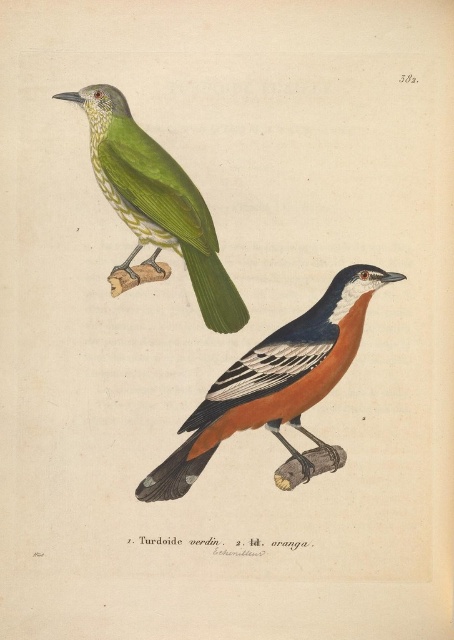
Where is `orange matte bird at center`? orange matte bird at center is located at coordinates (275, 381).

The height and width of the screenshot is (640, 454). What do you see at coordinates (275, 381) in the screenshot?
I see `orange matte bird at center` at bounding box center [275, 381].

Locate an element on the screen. The image size is (454, 640). orange matte bird at center is located at coordinates (275, 381).